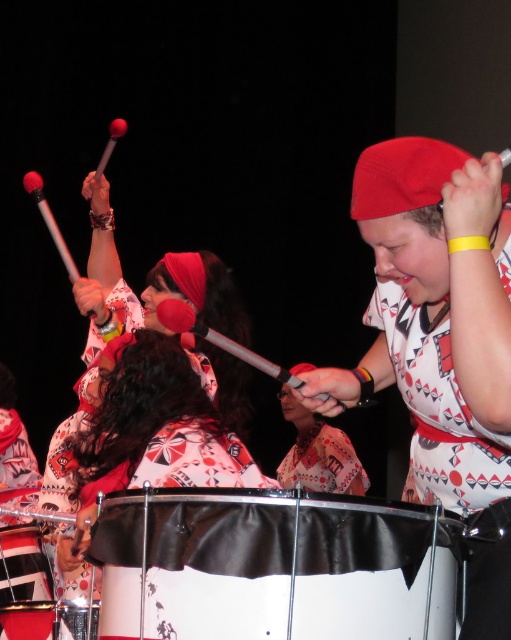
You are a stagehand preparing to place a 70 cm long microphone stand between the white matte drum at center and the yellow rubber band at upper center. Can the microphone stand fit between them without overlapping either object?

The distance between the white matte drum at center and the yellow rubber band at upper center is 74.27 centimeters. Since the microphone stand is 70 cm long, it can fit between them as the available space is larger than the stand.